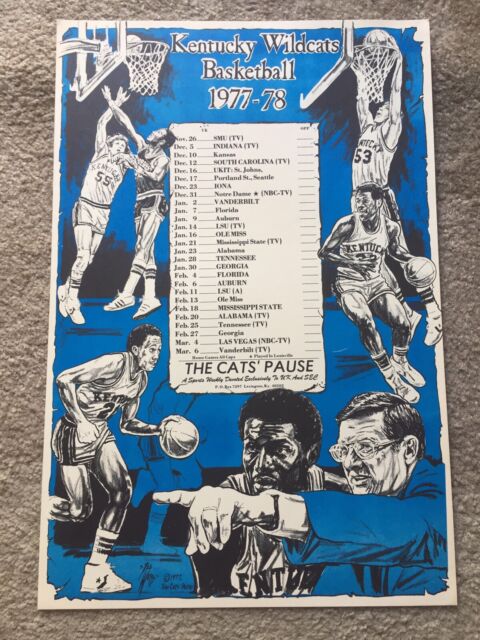
Find the location of a particular element. Image resolution: width=480 pixels, height=640 pixels. long poster is located at coordinates (221, 307).